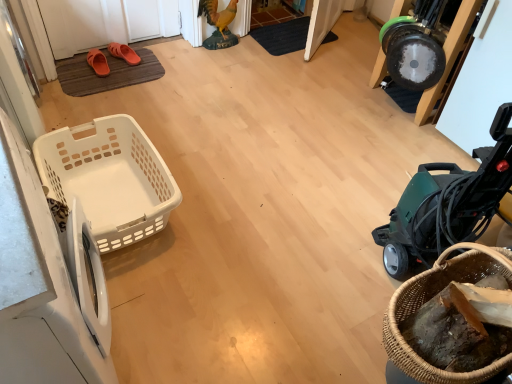
Find the location of a particular element. This screenshot has width=512, height=384. empty space that is in between white plastic basket at left, the 2th basket in the right-to-left sequence, and black textured doormat at center, arranged as the 2th doormat when ordered from the bottom is located at coordinates pyautogui.click(x=228, y=111).